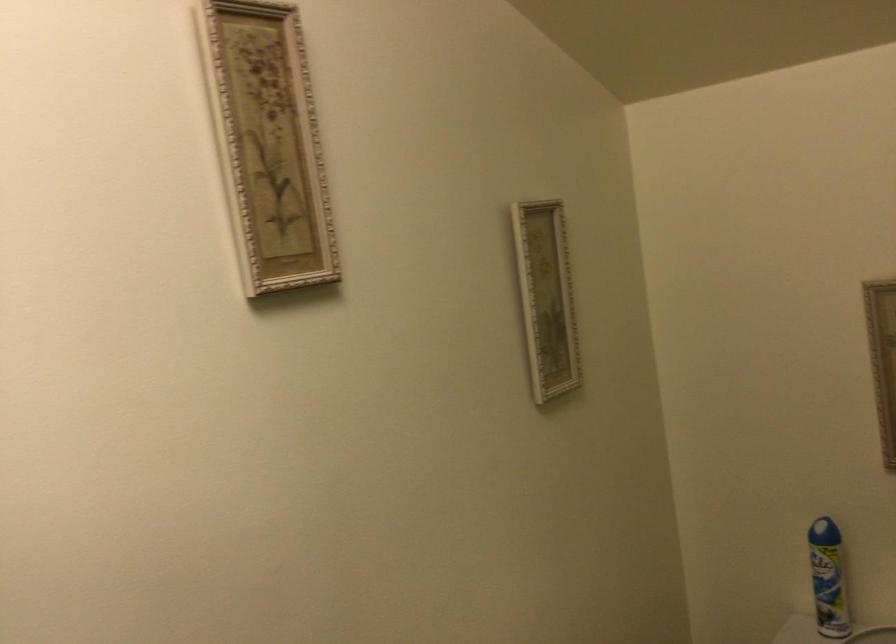
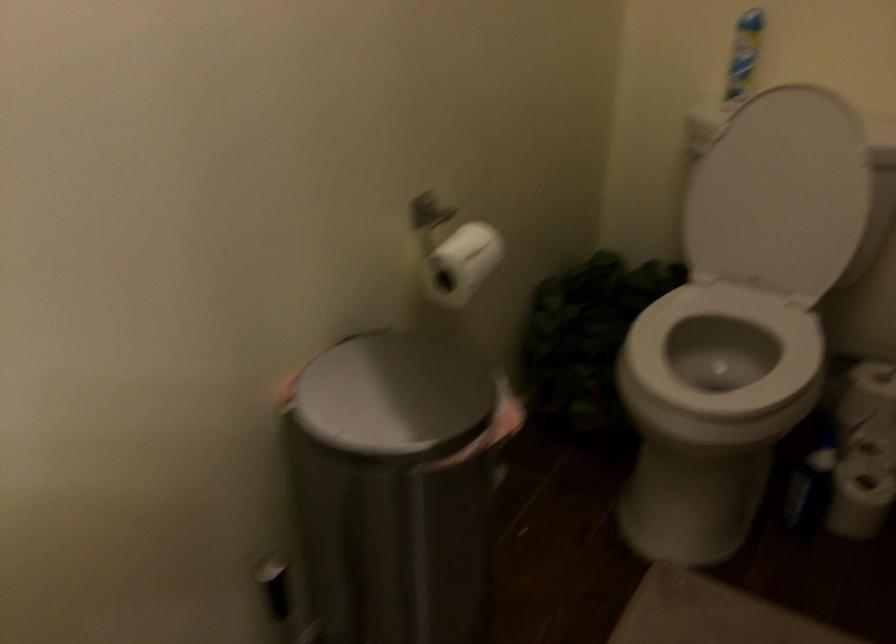
Question: The first image is from the beginning of the video and the second image is from the end. How did the camera likely rotate when shooting the video?

Choices:
 (A) Left
 (B) Right
 (C) Up
 (D) Down

Answer: (D)